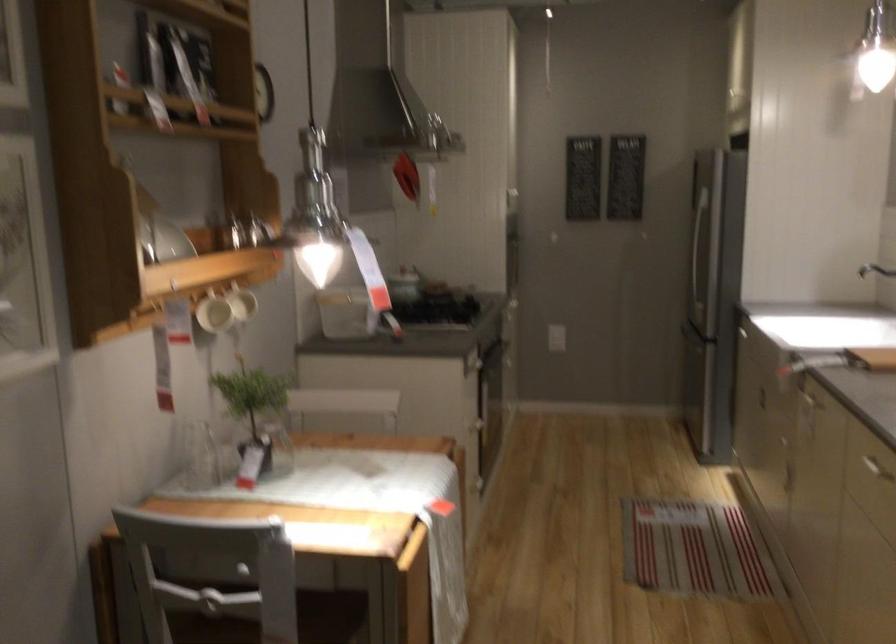
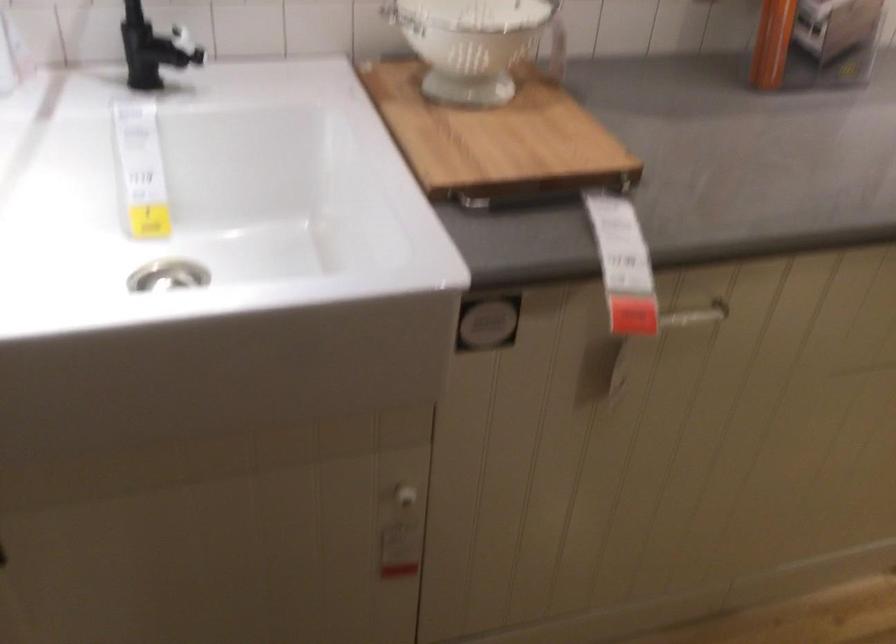
Find the pixel in the second image that matches point 807,442 in the first image.

(403, 497)